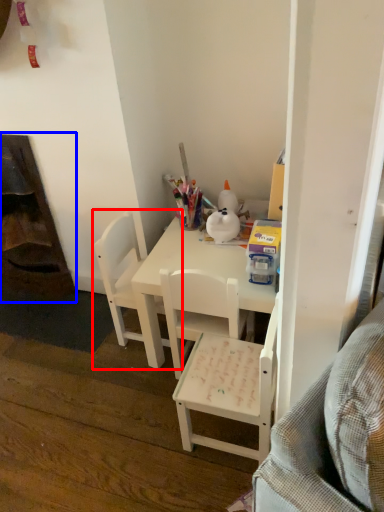
Question: Which point is further to the camera, chair (highlighted by a red box) or fireplace (highlighted by a blue box)?

Choices:
 (A) chair
 (B) fireplace

Answer: (B)